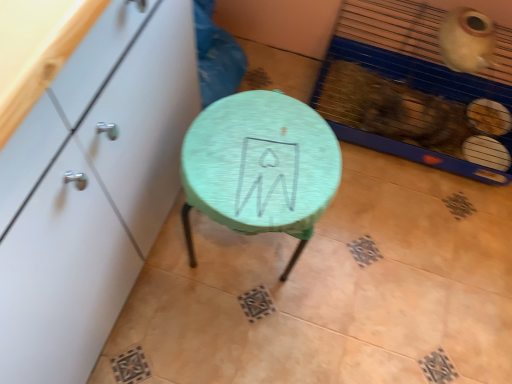
At what (x,y) coordinates should I click in order to perform the action: click on free space in front of mint green fabric stool at center. Please return your answer as a coordinate pair (x, y). This screenshot has width=512, height=384. Looking at the image, I should click on 229,329.